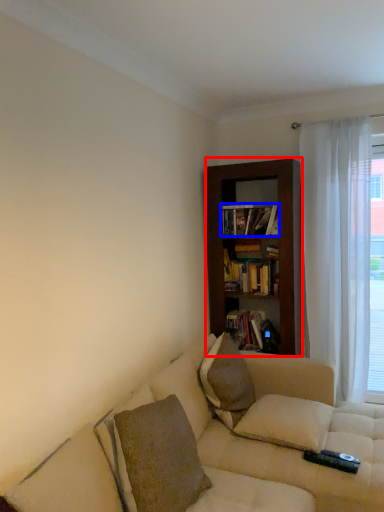
Question: Which object is further to the camera taking this photo, bookcase (highlighted by a red box) or book (highlighted by a blue box)?

Choices:
 (A) bookcase
 (B) book

Answer: (B)